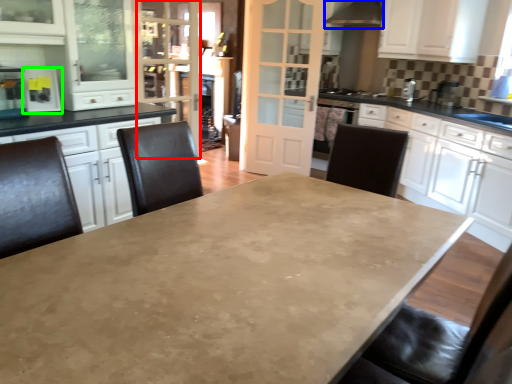
Question: Estimate the real-world distances between objects in this image. Which object is farther from glass door (highlighted by a red box), exhaust hood (highlighted by a blue box) or appliance (highlighted by a green box)?

Choices:
 (A) exhaust hood
 (B) appliance

Answer: (A)